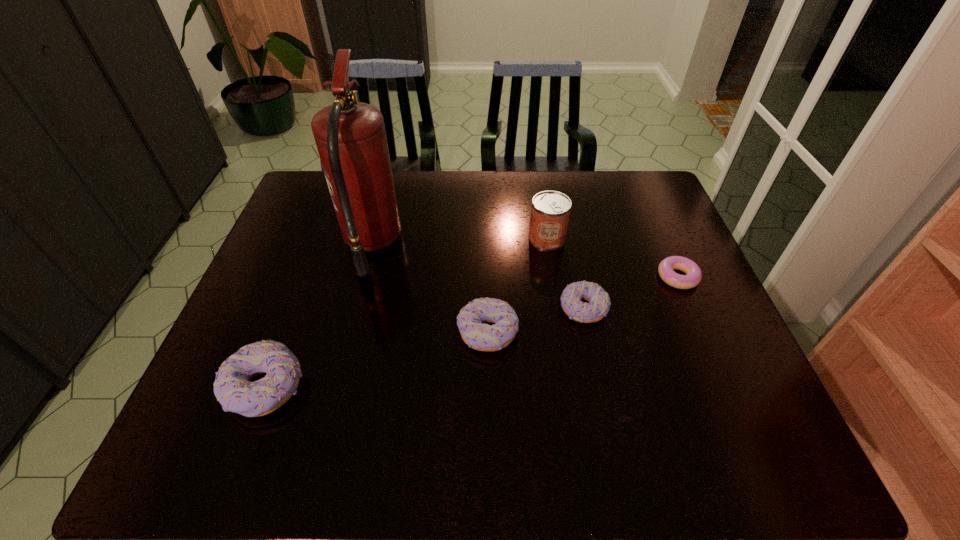
Locate an element on the screen. The height and width of the screenshot is (540, 960). vacant area in the image that satisfies the following two spatial constraints: 1. at the front of the second shortest doughnut where the nozzle is aimed; 2. on the right side of the fire extinguisher is located at coordinates (355, 309).

Where is `free spot that satisfies the following two spatial constraints: 1. at the front of the fire extinguisher where the nozzle is aimed; 2. on the left side of the third doughnut from left to right`? The image size is (960, 540). free spot that satisfies the following two spatial constraints: 1. at the front of the fire extinguisher where the nozzle is aimed; 2. on the left side of the third doughnut from left to right is located at coordinates (355, 309).